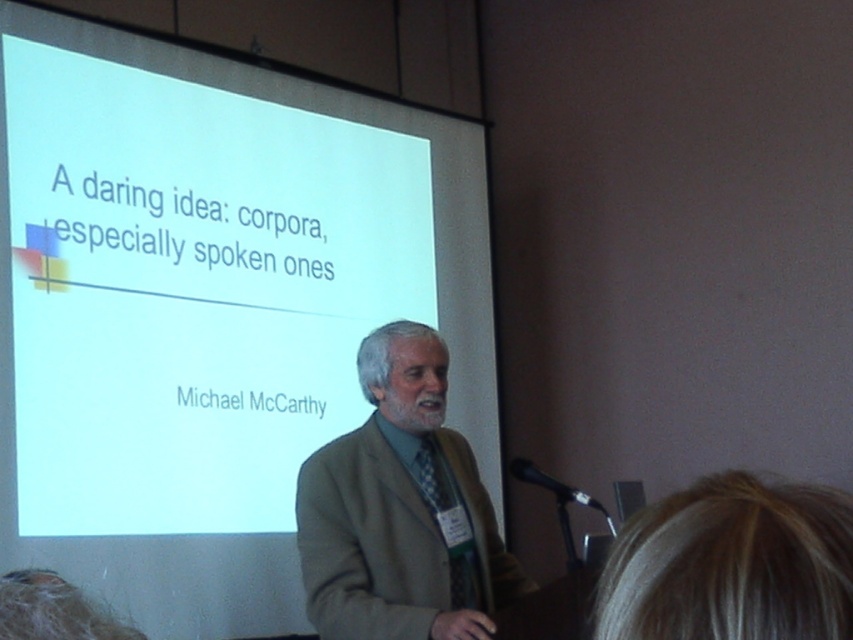
Question: Among these objects, which one is farthest from the camera?

Choices:
 (A) beige woolen jacket at center
 (B) white matte projection screen at upper center
 (C) black plastic microphone at lower right

Answer: (B)

Question: Can you confirm if white matte projection screen at upper center is positioned below beige woolen jacket at center?

Choices:
 (A) no
 (B) yes

Answer: (A)

Question: Among these objects, which one is farthest from the camera?

Choices:
 (A) black plastic microphone at lower right
 (B) beige woolen jacket at center
 (C) white matte projection screen at upper center

Answer: (C)

Question: Does white matte projection screen at upper center appear on the left side of beige woolen jacket at center?

Choices:
 (A) no
 (B) yes

Answer: (B)

Question: Can you confirm if white matte projection screen at upper center is smaller than beige woolen jacket at center?

Choices:
 (A) no
 (B) yes

Answer: (A)

Question: Estimate the real-world distances between objects in this image. Which object is farther from the black plastic microphone at lower right?

Choices:
 (A) beige woolen jacket at center
 (B) white matte projection screen at upper center

Answer: (B)